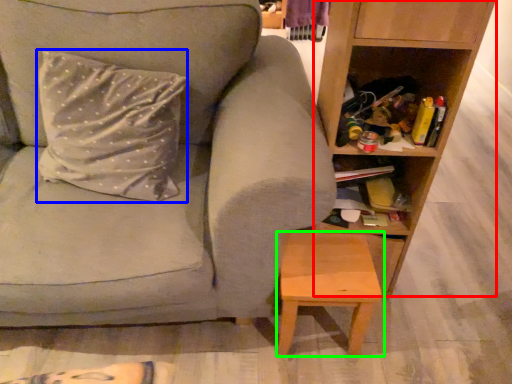
Question: Which is nearer to the shelf (highlighted by a red box)? pillow (highlighted by a blue box) or stool (highlighted by a green box).

Choices:
 (A) pillow
 (B) stool

Answer: (B)